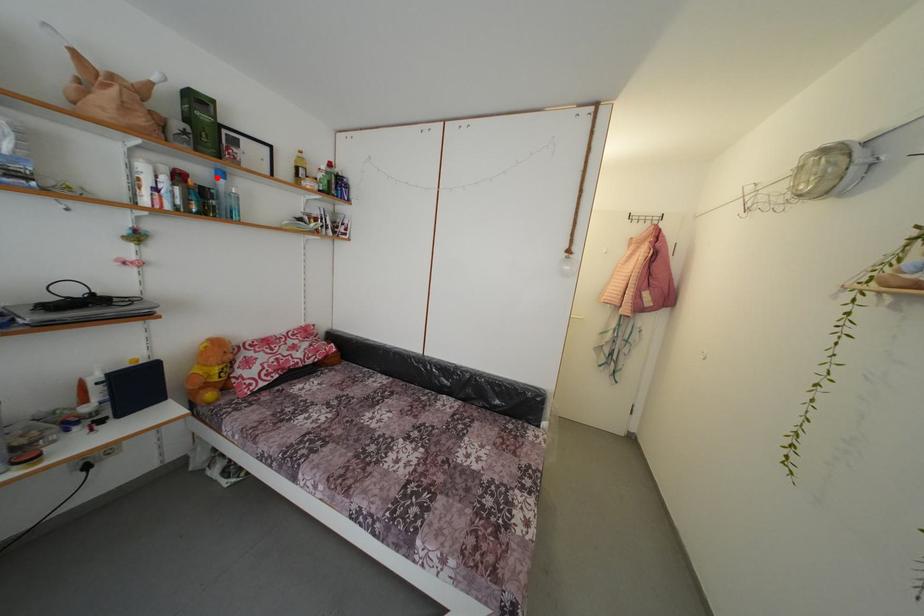
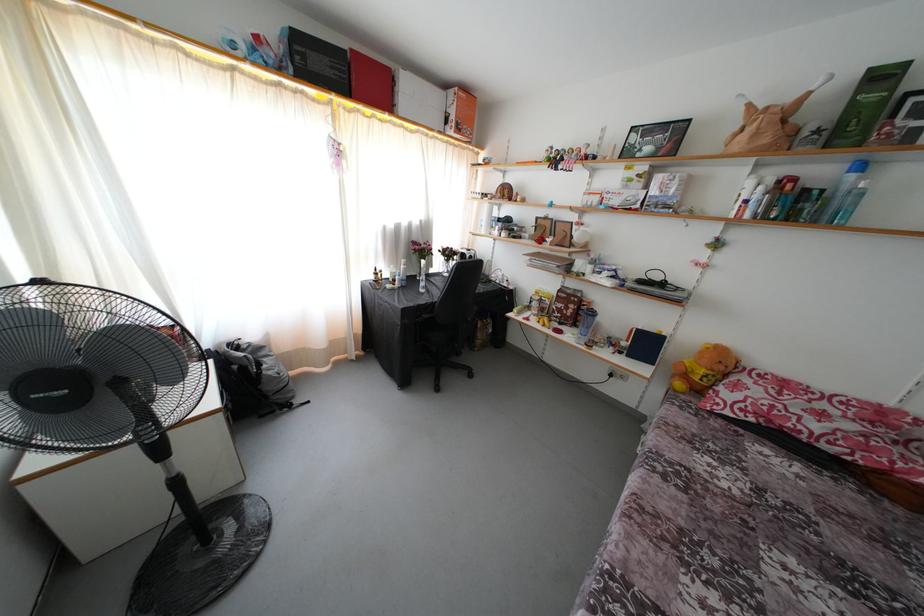
Question: I am providing you with two images of the same scene from different viewpoints. A red point is marked on the first image. Is the red point's position out of view in image 2?

Choices:
 (A) Yes
 (B) No

Answer: (B)